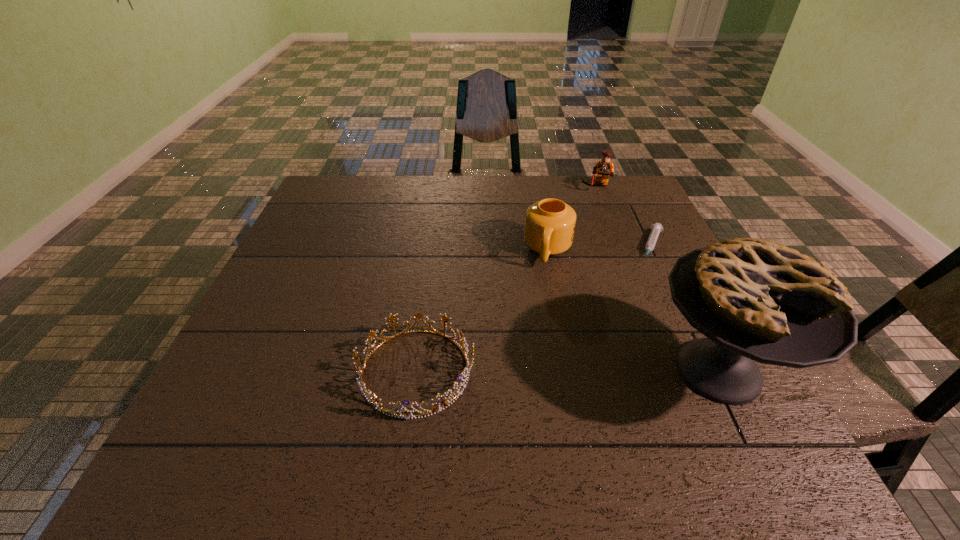
Where is `the leftmost object`? the leftmost object is located at coordinates (374, 400).

Where is `the second shortest object`? the second shortest object is located at coordinates (374, 400).

The width and height of the screenshot is (960, 540). What are the coordinates of `pie` in the screenshot? It's located at (755, 300).

Locate an element on the screen. The height and width of the screenshot is (540, 960). syringe is located at coordinates (656, 228).

Identify the location of the farthest object. The image size is (960, 540). (604, 168).

You are a GUI agent. You are given a task and a screenshot of the screen. Output one action in this format:
    pyautogui.click(x=<x>, y=<y>)
    Task: Click on the second object from left to right
    
    Given the screenshot: What is the action you would take?
    pyautogui.click(x=550, y=223)

I want to click on vacant position located on the front-facing side of the tiara, so click(x=593, y=371).

Where is `free space located 0.260m at the needle end of the shortest object`? The image size is (960, 540). free space located 0.260m at the needle end of the shortest object is located at coordinates (628, 328).

I want to click on vacant space located 0.380m at the needle end of the shortest object, so click(614, 367).

What are the coordinates of `vacant area situated 0.160m at the needle end of the shortest object` in the screenshot? It's located at (638, 300).